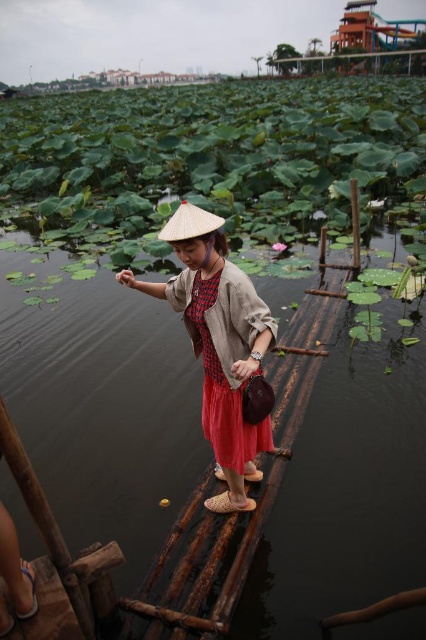
You are a photographer standing on the wooden plank pathway. You want to take a photo of the dark brown water at center and the natural straw hat at center. How far apart are these two objects in your frame?

The distance between the dark brown water at center and the natural straw hat at center is 9.78 feet.

You are a photographer standing at the edge of the wooden plank pathway. You want to capture a photo of the dark brown water at center and the matte brown hat at center in the same frame. Which object should you zoom in on more to ensure both are visible?

The dark brown water at center has a lesser width compared to matte brown hat at center, so you should zoom in more on the matte brown hat at center to ensure both fit in the frame.